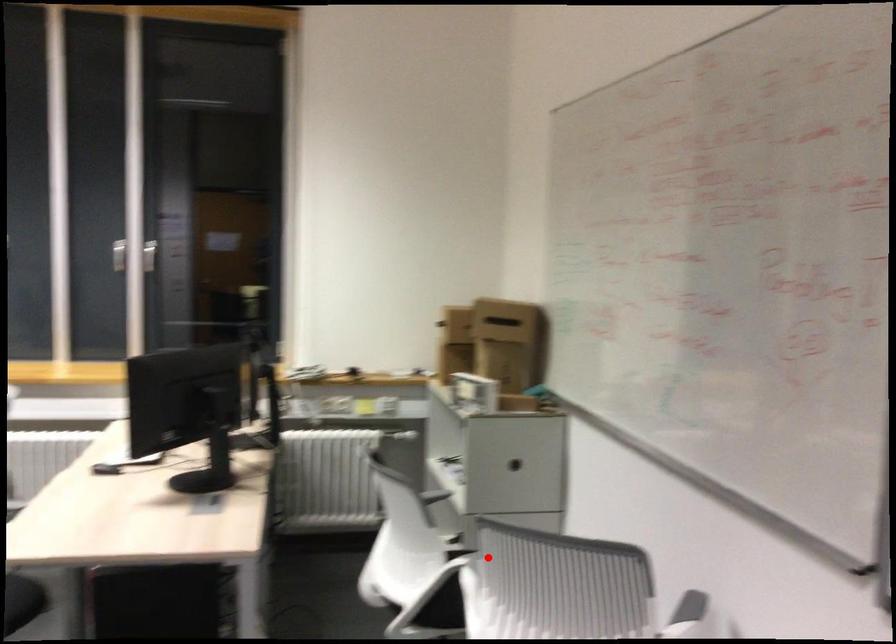
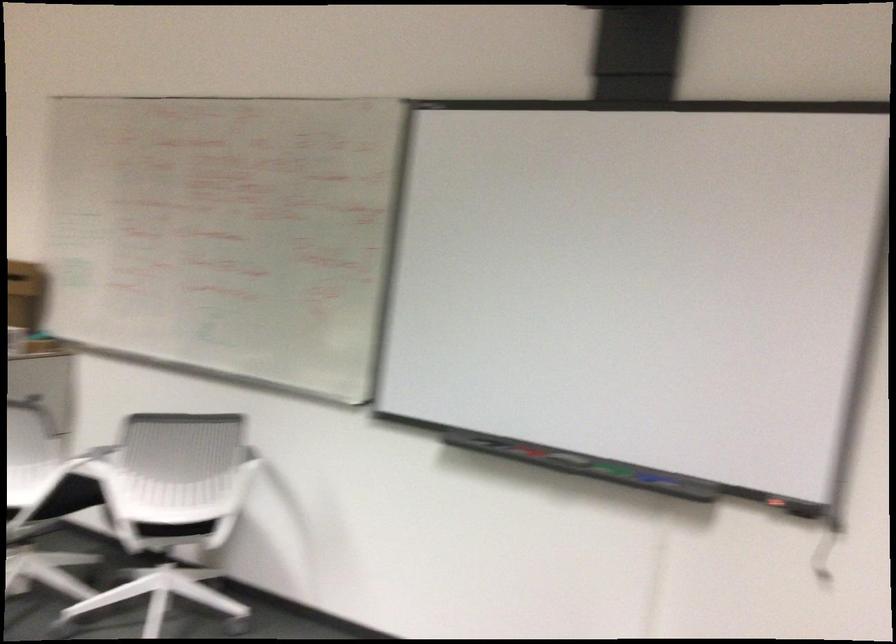
The point at the highlighted location is marked in the first image. Where is the corresponding point in the second image?

(95, 460)